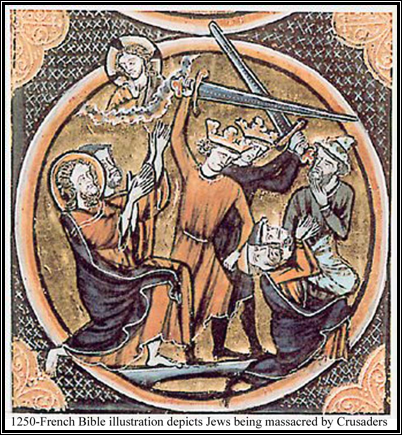
This screenshot has height=435, width=402. I want to click on decorative reliefs, so click(36, 46), click(26, 379), click(366, 396), click(383, 39).